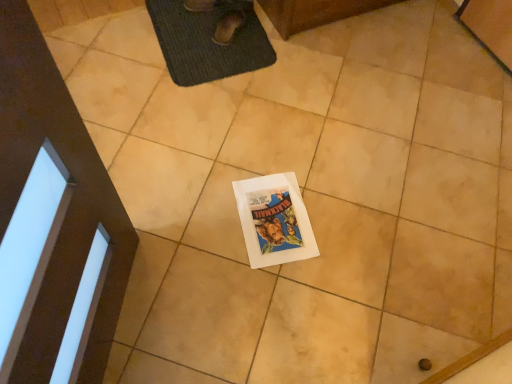
Question: Is dark gray textured bath mat at upper center completely or partially outside of brown suede shoe at upper center?

Choices:
 (A) yes
 (B) no

Answer: (A)

Question: Considering the relative sizes of dark gray textured bath mat at upper center and brown suede shoe at upper center in the image provided, is dark gray textured bath mat at upper center smaller than brown suede shoe at upper center?

Choices:
 (A) yes
 (B) no

Answer: (B)

Question: From the image's perspective, is dark gray textured bath mat at upper center over brown suede shoe at upper center?

Choices:
 (A) yes
 (B) no

Answer: (B)

Question: Are dark gray textured bath mat at upper center and brown suede shoe at upper center located far from each other?

Choices:
 (A) no
 (B) yes

Answer: (A)

Question: Is brown suede shoe at upper center surrounded by dark gray textured bath mat at upper center?

Choices:
 (A) yes
 (B) no

Answer: (A)

Question: From the image's perspective, is brown suede shoe at upper center located above or below dark gray textured bath mat at upper center?

Choices:
 (A) above
 (B) below

Answer: (A)

Question: Considering the relative positions of brown suede shoe at upper center and dark gray textured bath mat at upper center in the image provided, is brown suede shoe at upper center to the left or to the right of dark gray textured bath mat at upper center?

Choices:
 (A) right
 (B) left

Answer: (A)

Question: In terms of height, does brown suede shoe at upper center look taller or shorter compared to dark gray textured bath mat at upper center?

Choices:
 (A) short
 (B) tall

Answer: (B)

Question: Is point (237, 21) closer or farther from the camera than point (181, 16)?

Choices:
 (A) farther
 (B) closer

Answer: (A)

Question: From the image's perspective, relative to dark gray textured bath mat at upper center, is white paper comic book at center above or below?

Choices:
 (A) above
 (B) below

Answer: (B)

Question: From their relative heights in the image, would you say white paper comic book at center is taller or shorter than dark gray textured bath mat at upper center?

Choices:
 (A) short
 (B) tall

Answer: (A)

Question: From a real-world perspective, is white paper comic book at center physically located above or below dark gray textured bath mat at upper center?

Choices:
 (A) below
 (B) above

Answer: (A)

Question: Is point (261, 258) positioned closer to the camera than point (217, 54)?

Choices:
 (A) farther
 (B) closer

Answer: (B)

Question: Is brown suede shoe at upper center in front of or behind white paper comic book at center in the image?

Choices:
 (A) front
 (B) behind

Answer: (B)

Question: Is brown suede shoe at upper center wider or thinner than white paper comic book at center?

Choices:
 (A) wide
 (B) thin

Answer: (B)